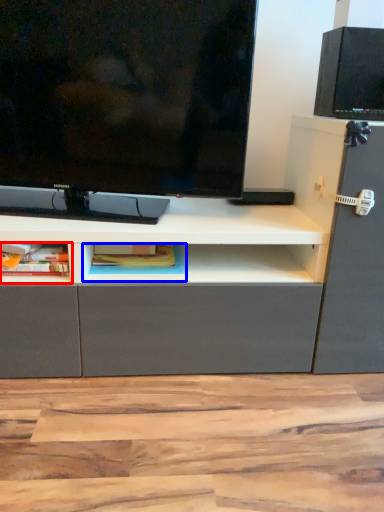
Question: Among these objects, which one is nearest to the camera, cabinet (highlighted by a red box) or cabinet (highlighted by a blue box)?

Choices:
 (A) cabinet
 (B) cabinet

Answer: (A)